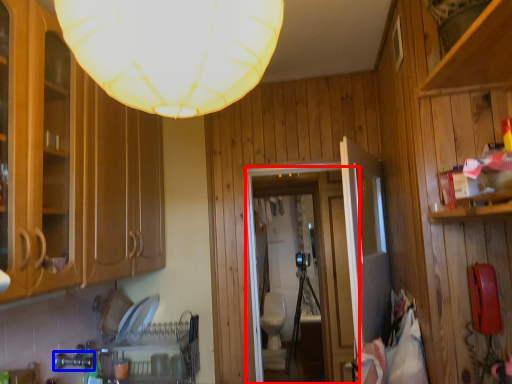
Question: Which object appears closest to the camera in this image, glass door (highlighted by a red box) or faucet (highlighted by a blue box)?

Choices:
 (A) glass door
 (B) faucet

Answer: (B)